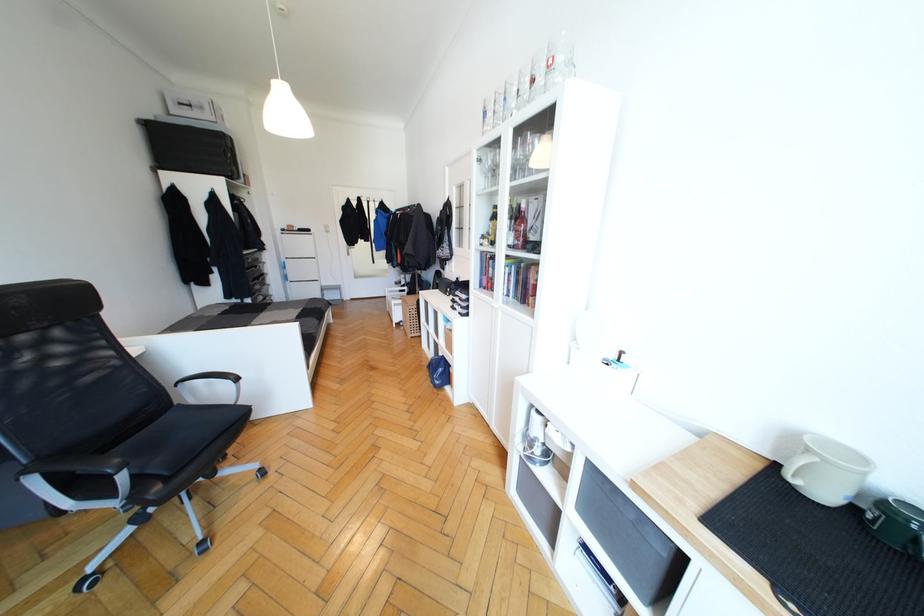
Where is `green mug`? The width and height of the screenshot is (924, 616). green mug is located at coordinates (827, 469).